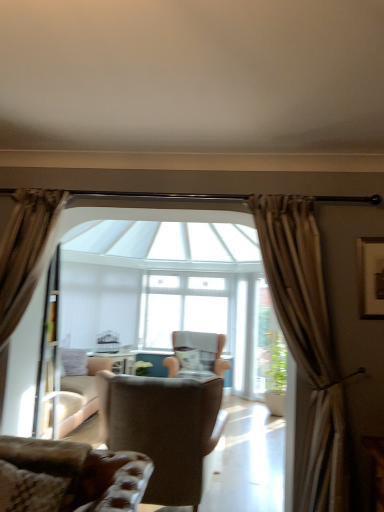
Question: Considering the positions of point (147, 316) and point (165, 387), is point (147, 316) closer or farther from the camera than point (165, 387)?

Choices:
 (A) farther
 (B) closer

Answer: (A)

Question: Is clear glass window at center spatially inside brown leather armchair at center, marked as the second chair in a front-to-back arrangement, or outside of it?

Choices:
 (A) outside
 (B) inside

Answer: (A)

Question: Considering the real-world distances, which object is closest to the brown leather armchair at center, marked as the second chair in a front-to-back arrangement?

Choices:
 (A) velvet gray pillow at center
 (B) velvet brown armchair at center, acting as the first chair starting from the back
 (C) clear glass window at center
 (D) wooden framed artwork at upper right
 (E) leather at lower left, which ranks as the 3th chair in back-to-front order

Answer: (E)

Question: Which is nearer to the wooden framed artwork at upper right?

Choices:
 (A) velvet brown armchair at center, acting as the first chair starting from the back
 (B) brown leather armchair at center, marked as the second chair in a front-to-back arrangement
 (C) clear glass window at center
 (D) velvet gray pillow at center
 (E) leather at lower left, which ranks as the 3th chair in back-to-front order

Answer: (B)